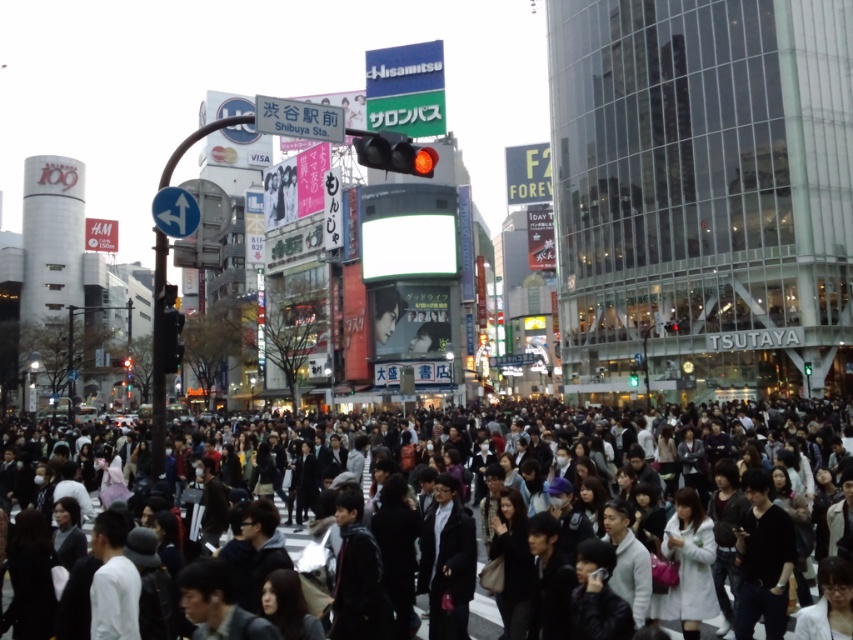
Question: Among these objects, which one is nearest to the camera?

Choices:
 (A) dark brown hair at lower center
 (B) white matte shirt at lower left

Answer: (A)

Question: Is white matte coat at lower right positioned in front of black fabric bag at center?

Choices:
 (A) yes
 (B) no

Answer: (B)

Question: Is black fabric jacket at center to the right of black fabric bag at center from the viewer's perspective?

Choices:
 (A) yes
 (B) no

Answer: (B)

Question: Estimate the real-world distances between objects in this image. Which object is closer to the black fabric jacket at center?

Choices:
 (A) dark gray clothing at center
 (B) dark brown hair at lower center

Answer: (B)

Question: Which is nearer to the black leather jacket at center?

Choices:
 (A) white matte shirt at lower left
 (B) black matte shirt at lower right
 (C) gray sweater at center
 (D) dark gray coat at lower left

Answer: (C)

Question: Is dark gray jacket at center above dark brown hair at lower center?

Choices:
 (A) yes
 (B) no

Answer: (A)